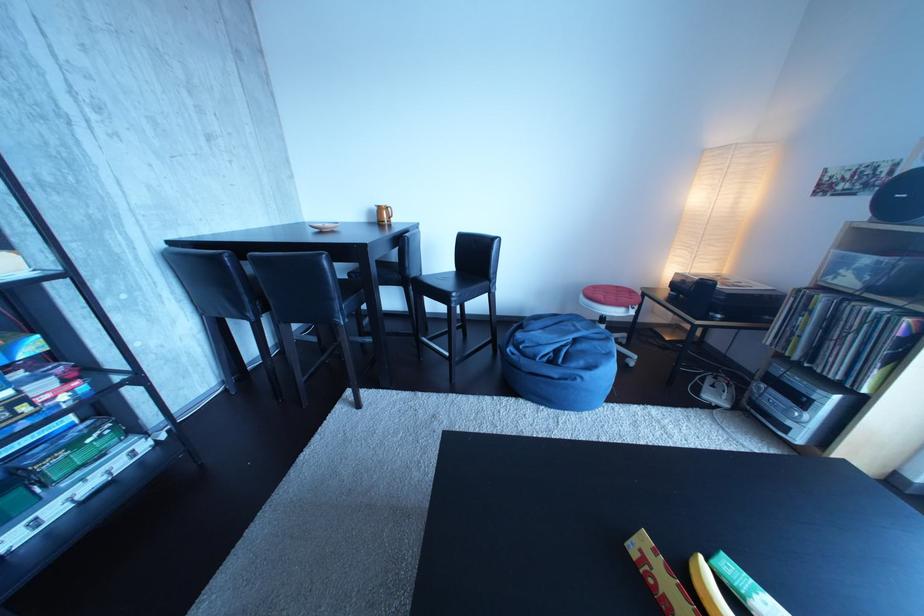
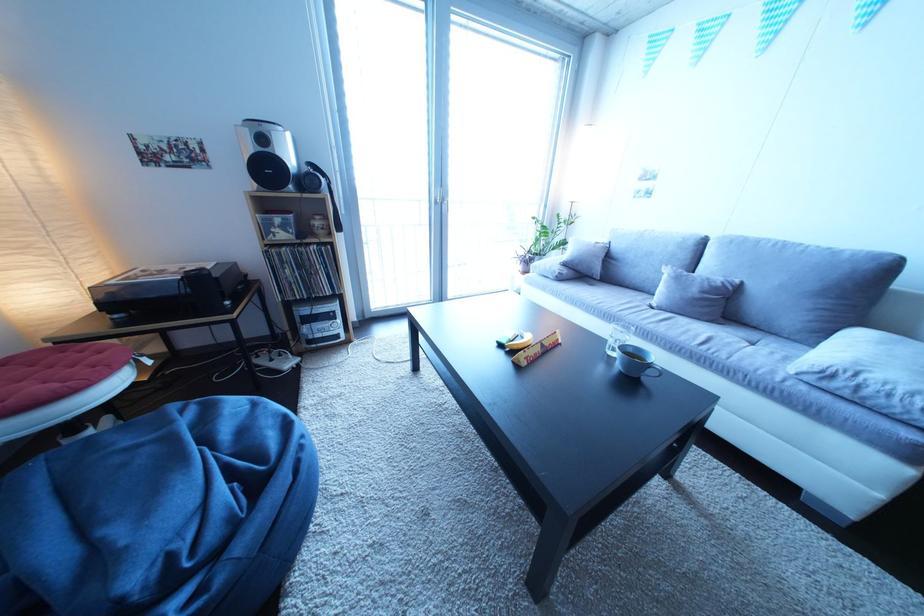
The point at (726, 392) is marked in the first image. Where is the corresponding point in the second image?

(285, 366)